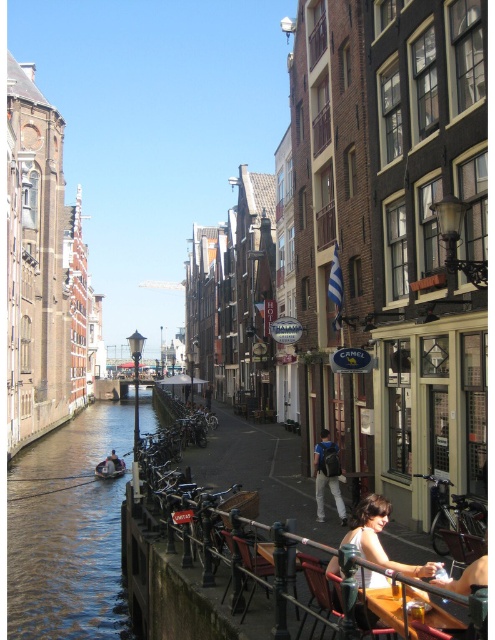
Question: Does light brown hair at lower right have a larger size compared to dark blue backpack at center?

Choices:
 (A) yes
 (B) no

Answer: (A)

Question: Which point is farther to the camera?

Choices:
 (A) clear water at lower left
 (B) wooden chair at lower center

Answer: (A)

Question: Among these objects, which one is farthest from the camera?

Choices:
 (A) dark blue backpack at center
 (B) wooden chair at lower center
 (C) light brown hair at lower right
 (D) wooden boat at lower left

Answer: (D)

Question: Does wooden chair at lower center lie in front of wooden boat at lower left?

Choices:
 (A) no
 (B) yes

Answer: (B)

Question: Which point is closer to the camera?

Choices:
 (A) (370, 618)
 (B) (269, 573)

Answer: (A)

Question: Can you confirm if clear water at lower left is smaller than light brown hair at lower right?

Choices:
 (A) yes
 (B) no

Answer: (B)